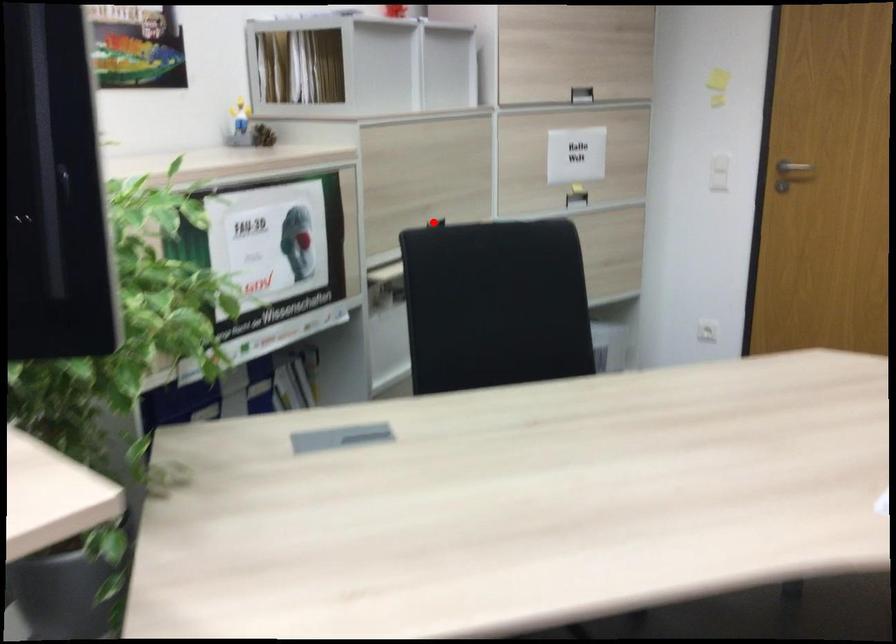
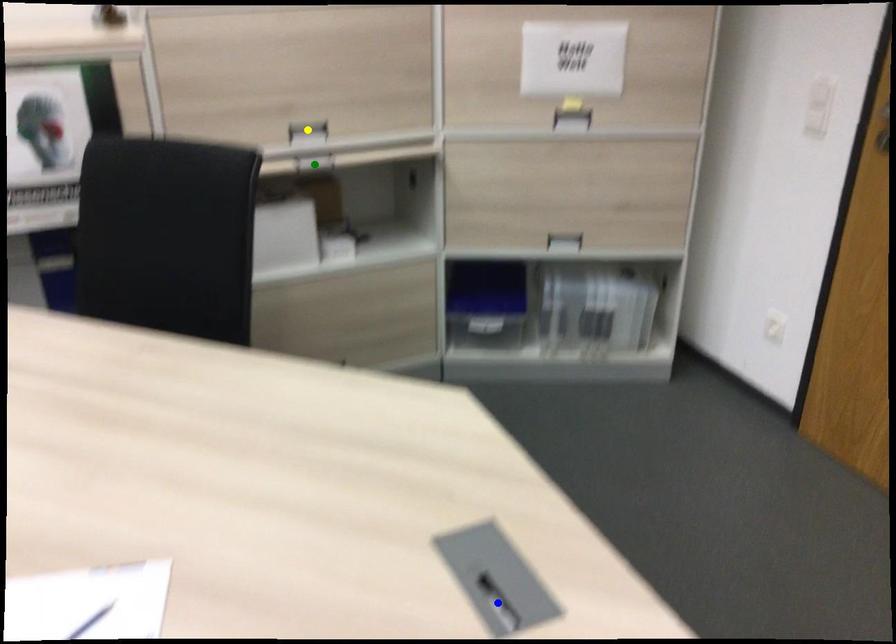
Question: I am providing you with two images of the same scene from different viewpoints. A red point is marked on the first image. You are given multiple points on the second image. Can you choose the point in image 2 that corresponds to the point in image 1?

Choices:
 (A) green point
 (B) yellow point
 (C) blue point

Answer: (B)